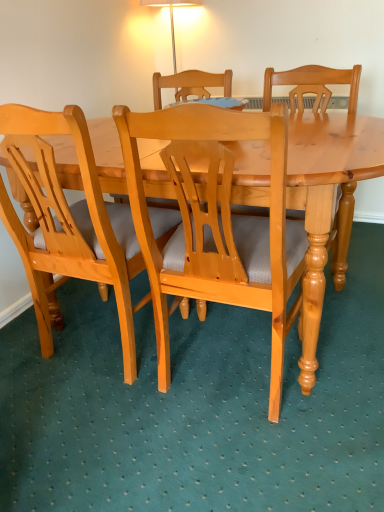
This screenshot has height=512, width=384. Identify the location of free space in front of matte wood chair at center, the 2th chair in the right-to-left sequence. pos(105,435).